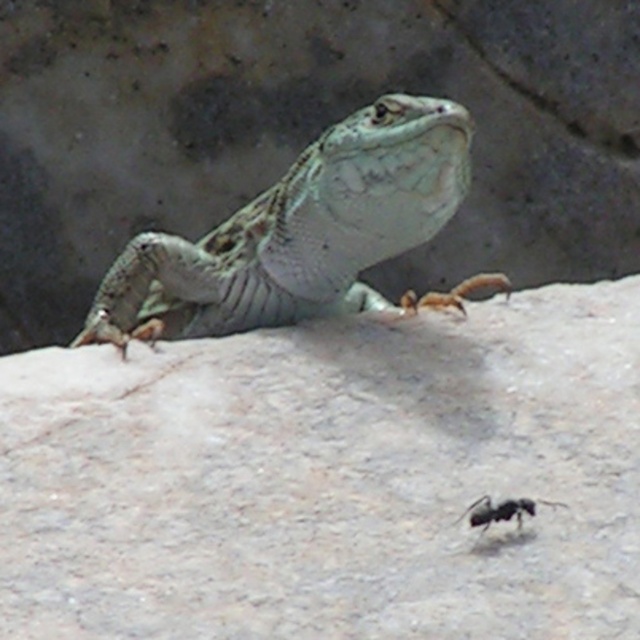
Question: Which object appears farthest from the camera in this image?

Choices:
 (A) speckled green lizard at center
 (B) black matte ant at lower center

Answer: (A)

Question: Can you confirm if speckled green lizard at center is bigger than black matte ant at lower center?

Choices:
 (A) no
 (B) yes

Answer: (B)

Question: Can you confirm if speckled green lizard at center is thinner than black matte ant at lower center?

Choices:
 (A) yes
 (B) no

Answer: (B)

Question: Which point is closer to the camera?

Choices:
 (A) speckled green lizard at center
 (B) black matte ant at lower center

Answer: (B)

Question: Can you confirm if speckled green lizard at center is positioned above black matte ant at lower center?

Choices:
 (A) yes
 (B) no

Answer: (A)